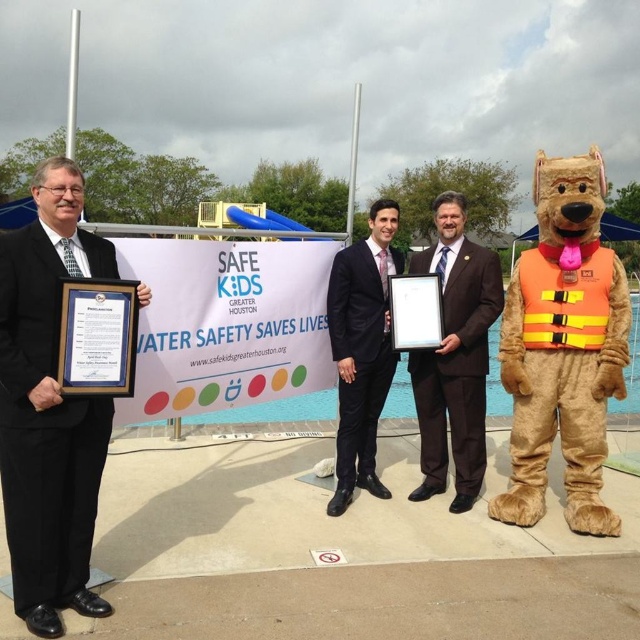
From the picture: You are a photographer at the event and need to arrange the two individuals wearing black matte suit at left and black suit at center for a group photo. The requirement is to have the taller person stand behind the shorter one to avoid blocking the view. Which individual should be placed in the back?

The black matte suit at left should be placed in the back because it has a greater height compared to the black suit at center.